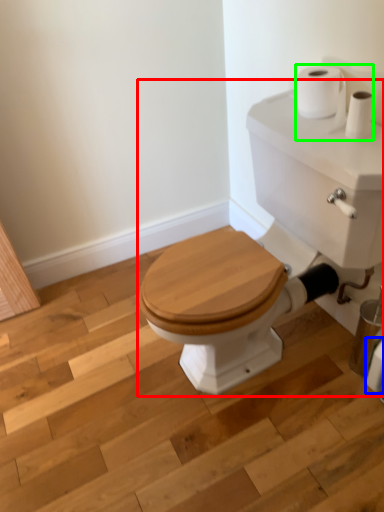
Question: Which object is positioned farthest from porcelain (highlighted by a red box)? Select from toilet paper (highlighted by a blue box) and toilet paper (highlighted by a green box).

Choices:
 (A) toilet paper
 (B) toilet paper

Answer: (A)